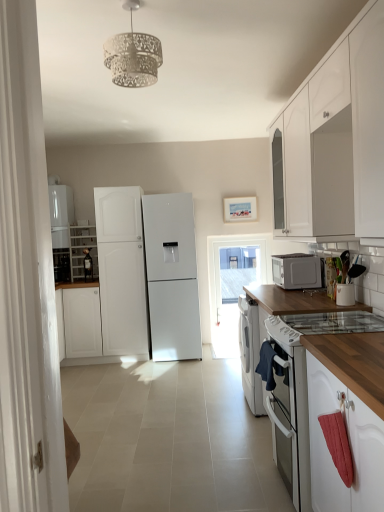
The width and height of the screenshot is (384, 512). What do you see at coordinates (133, 55) in the screenshot?
I see `white textured lampshade at upper center` at bounding box center [133, 55].

Image resolution: width=384 pixels, height=512 pixels. Describe the element at coordinates (121, 270) in the screenshot. I see `white matte refrigerator at center, the 2th refrigerator when ordered from left to right` at that location.

The image size is (384, 512). I want to click on satin silver microwave at right, so click(x=296, y=271).

This screenshot has width=384, height=512. What do you see at coordinates (296, 271) in the screenshot? I see `satin silver microwave at right` at bounding box center [296, 271].

This screenshot has height=512, width=384. What do you see at coordinates (232, 289) in the screenshot?
I see `transparent glass door at center` at bounding box center [232, 289].

At what (x,y) coordinates should I click in order to perform the action: click on white glass gas stove at lower right. Please return your answer as a coordinate pair (x, y). The height and width of the screenshot is (512, 384). Looking at the image, I should click on (321, 325).

Which is more to the right, white glass gas stove at lower right or white matte refrigerator at center, the 2th refrigerator when ordered from left to right?

white glass gas stove at lower right is more to the right.

How different are the orientations of white glass gas stove at lower right and white matte refrigerator at center, positioned as the first refrigerator in right-to-left order, in degrees?

white glass gas stove at lower right and white matte refrigerator at center, positioned as the first refrigerator in right-to-left order, are facing 90 degrees away from each other.

How far apart are white glass gas stove at lower right and white matte refrigerator at center, positioned as the first refrigerator in right-to-left order?

white glass gas stove at lower right and white matte refrigerator at center, positioned as the first refrigerator in right-to-left order, are 2.61 meters apart from each other.

Considering the positions of point (327, 328) and point (131, 247), is point (327, 328) closer or farther from the camera than point (131, 247)?

Point (327, 328) is positioned closer to the camera compared to point (131, 247).

Are white glossy cabinet at upper right, marked as the 1th cabinetry in a front-to-back arrangement, and transparent glass door at center located far from each other?

white glossy cabinet at upper right, marked as the 1th cabinetry in a front-to-back arrangement, is far away from transparent glass door at center.

Based on their sizes in the image, would you say white glossy cabinet at upper right, the first cabinetry when ordered from right to left, is bigger or smaller than transparent glass door at center?

In the image, white glossy cabinet at upper right, the first cabinetry when ordered from right to left, appears to be larger than transparent glass door at center.

Can you confirm if white glossy cabinet at upper right, which ranks as the second cabinetry in back-to-front order, is shorter than transparent glass door at center?

Yes.

In order to click on glass door behind the white glossy cabinet at upper right, which ranks as the second cabinetry in back-to-front order in this screenshot , I will do coord(232,289).

Are white glass gas stove at lower right and white wood cabinet at left, the first cabinetry when ordered from back to front, located far from each other?

Yes, white glass gas stove at lower right and white wood cabinet at left, the first cabinetry when ordered from back to front, are quite far apart.

What's the angular difference between white glass gas stove at lower right and white wood cabinet at left, acting as the 2th cabinetry starting from the front,'s facing directions?

The angular difference between white glass gas stove at lower right and white wood cabinet at left, acting as the 2th cabinetry starting from the front, is 90 degrees.

Is white wood cabinet at left, the 1th cabinetry positioned from the left, inside white glass gas stove at lower right?

That's incorrect, white wood cabinet at left, the 1th cabinetry positioned from the left, is not inside white glass gas stove at lower right.

Can you confirm if white glass gas stove at lower right is positioned to the left of white wood cabinet at left, the first cabinetry when ordered from back to front?

In fact, white glass gas stove at lower right is to the right of white wood cabinet at left, the first cabinetry when ordered from back to front.

From the image's perspective, is white matte refrigerator at left, the 1th refrigerator from the left, above or below white wood cabinet at left, the first cabinetry when ordered from back to front?

white matte refrigerator at left, the 1th refrigerator from the left, is above white wood cabinet at left, the first cabinetry when ordered from back to front.

Between white matte refrigerator at left, which is the second refrigerator from right to left, and white wood cabinet at left, the 1th cabinetry positioned from the left, which one appears on the right side from the viewer's perspective?

From the viewer's perspective, white wood cabinet at left, the 1th cabinetry positioned from the left, appears more on the right side.

Is white matte refrigerator at left, the 1th refrigerator from the left, facing towards white wood cabinet at left, the 1th cabinetry positioned from the left?

No, white matte refrigerator at left, the 1th refrigerator from the left, is not turned towards white wood cabinet at left, the 1th cabinetry positioned from the left.

From the image's perspective, would you say white glossy cabinet at upper right, marked as the 1th cabinetry in a front-to-back arrangement, is positioned over white matte refrigerator at center, positioned as the first refrigerator in right-to-left order?

Yes, from the image's perspective, white glossy cabinet at upper right, marked as the 1th cabinetry in a front-to-back arrangement, is above white matte refrigerator at center, positioned as the first refrigerator in right-to-left order.

From a real-world perspective, is white glossy cabinet at upper right, the 2th cabinetry positioned from the left, positioned over white matte refrigerator at center, the 2th refrigerator when ordered from left to right, based on gravity?

Yes.

Considering the sizes of white glossy cabinet at upper right, marked as the 1th cabinetry in a front-to-back arrangement, and white matte refrigerator at center, positioned as the first refrigerator in right-to-left order, in the image, is white glossy cabinet at upper right, marked as the 1th cabinetry in a front-to-back arrangement, taller or shorter than white matte refrigerator at center, positioned as the first refrigerator in right-to-left order,?

white glossy cabinet at upper right, marked as the 1th cabinetry in a front-to-back arrangement, is shorter than white matte refrigerator at center, positioned as the first refrigerator in right-to-left order.

Are wooden at right and white wood cabinet at left, the first cabinetry when ordered from back to front, located far from each other?

wooden at right is positioned a significant distance from white wood cabinet at left, the first cabinetry when ordered from back to front.

Considering the relative sizes of wooden at right and white wood cabinet at left, the first cabinetry when ordered from back to front, in the image provided, is wooden at right shorter than white wood cabinet at left, the first cabinetry when ordered from back to front,?

No, wooden at right is not shorter than white wood cabinet at left, the first cabinetry when ordered from back to front.

Is wooden at right surrounding white wood cabinet at left, acting as the second cabinetry starting from the right?

No, white wood cabinet at left, acting as the second cabinetry starting from the right, is not a part of wooden at right.

Considering the relative sizes of transparent glass door at center and white glossy cabinet at upper right, which ranks as the second cabinetry in back-to-front order, in the image provided, is transparent glass door at center bigger than white glossy cabinet at upper right, which ranks as the second cabinetry in back-to-front order,?

Incorrect, transparent glass door at center is not larger than white glossy cabinet at upper right, which ranks as the second cabinetry in back-to-front order.

From a real-world perspective, which object stands above the other?

From a 3D spatial view, white glossy cabinet at upper right, marked as the 1th cabinetry in a front-to-back arrangement, is above.

Would you say transparent glass door at center is outside white glossy cabinet at upper right, marked as the 1th cabinetry in a front-to-back arrangement?

transparent glass door at center lies outside white glossy cabinet at upper right, marked as the 1th cabinetry in a front-to-back arrangement,'s area.

Considering the points (223, 281) and (372, 86), which point is behind, point (223, 281) or point (372, 86)?

The point (223, 281) is farther.

Locate an element on the screen. gas stove below the white matte refrigerator at center, positioned as the first refrigerator in right-to-left order (from the image's perspective) is located at coordinates (321, 325).

There is a transparent glass door at center. At what (x,y) coordinates should I click in order to perform the action: click on the 2nd cabinetry above it (from the image's perspective). Please return your answer as a coordinate pair (x, y). The height and width of the screenshot is (512, 384). Looking at the image, I should click on (338, 141).

Considering their positions, is satin silver microwave at right positioned closer to white glass gas stove at lower right than white glossy cabinet at upper right, the first cabinetry when ordered from right to left?

white glossy cabinet at upper right, the first cabinetry when ordered from right to left, lies closer to white glass gas stove at lower right than the other object.

Looking at this image, considering their positions, is transparent glass door at center positioned further to white matte refrigerator at left, the 1th refrigerator from the left, than satin silver microwave at right?

satin silver microwave at right is further to white matte refrigerator at left, the 1th refrigerator from the left.

From the image, which object appears to be farther from white glossy cabinet at upper right, which ranks as the second cabinetry in back-to-front order, white matte refrigerator at left, which is the second refrigerator from right to left, or white glass gas stove at lower right?

white matte refrigerator at left, which is the second refrigerator from right to left, is further to white glossy cabinet at upper right, which ranks as the second cabinetry in back-to-front order.

Considering their positions, is transparent glass door at center positioned closer to white matte refrigerator at left, the 1th refrigerator from the left, than white matte refrigerator at center, the 2th refrigerator when ordered from left to right?

Based on the image, white matte refrigerator at center, the 2th refrigerator when ordered from left to right, appears to be nearer to white matte refrigerator at left, the 1th refrigerator from the left.

From the image, which object appears to be farther from white matte refrigerator at left, the 1th refrigerator from the left, white glass gas stove at lower right or satin silver microwave at right?

white glass gas stove at lower right is positioned further to the anchor white matte refrigerator at left, the 1th refrigerator from the left.

Based on their spatial positions, is white matte refrigerator at center, the 2th refrigerator when ordered from left to right, or white glass gas stove at lower right further from white textured lampshade at upper center?

Based on the image, white matte refrigerator at center, the 2th refrigerator when ordered from left to right, appears to be further to white textured lampshade at upper center.

From the image, which object appears to be farther from white glass gas stove at lower right, white glossy cabinet at upper right, marked as the 1th cabinetry in a front-to-back arrangement, or white matte refrigerator at left, the 1th refrigerator from the left?

white matte refrigerator at left, the 1th refrigerator from the left, is positioned further to the anchor white glass gas stove at lower right.

Which object lies nearer to the anchor point white matte refrigerator at center, the 2th refrigerator when ordered from left to right, white wood cabinet at left, acting as the second cabinetry starting from the right, or white glossy cabinet at upper right, the 2th cabinetry positioned from the left?

white wood cabinet at left, acting as the second cabinetry starting from the right, lies closer to white matte refrigerator at center, the 2th refrigerator when ordered from left to right, than the other object.

I want to click on cabinetry between white matte refrigerator at left, which is the second refrigerator from right to left, and transparent glass door at center from left to right, so click(x=82, y=252).

This screenshot has width=384, height=512. What are the coordinates of `microwave oven between wooden at right and transparent glass door at center in the front-back direction` in the screenshot? It's located at (296, 271).

Find the location of `gas stove between white textured lampshade at upper center and white wood cabinet at left, the 1th cabinetry positioned from the left, in the front-back direction`. gas stove between white textured lampshade at upper center and white wood cabinet at left, the 1th cabinetry positioned from the left, in the front-back direction is located at coordinates (321, 325).

The width and height of the screenshot is (384, 512). Identify the location of refrigerator between white matte refrigerator at left, the 1th refrigerator from the left, and transparent glass door at center. (121, 270).